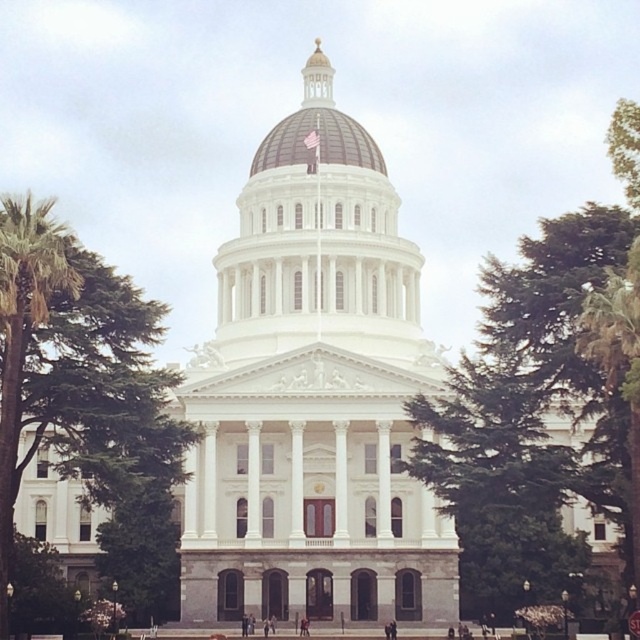
Question: Is green leafy tree at left to the left of brown domed roof at center from the viewer's perspective?

Choices:
 (A) yes
 (B) no

Answer: (A)

Question: Considering the relative positions of green leafy tree at center and brown domed roof at center in the image provided, where is green leafy tree at center located with respect to brown domed roof at center?

Choices:
 (A) left
 (B) right

Answer: (B)

Question: Which point is farther to the camera?

Choices:
 (A) green leafy tree at center
 (B) brown domed roof at center

Answer: (B)

Question: Estimate the real-world distances between objects in this image. Which object is farther from the brown domed roof at center?

Choices:
 (A) green leafy tree at center
 (B) green leafy tree at left

Answer: (A)

Question: Which point appears farthest from the camera in this image?

Choices:
 (A) (26, 225)
 (B) (595, 312)

Answer: (A)

Question: Does green leafy tree at left lie behind brown domed roof at center?

Choices:
 (A) yes
 (B) no

Answer: (B)